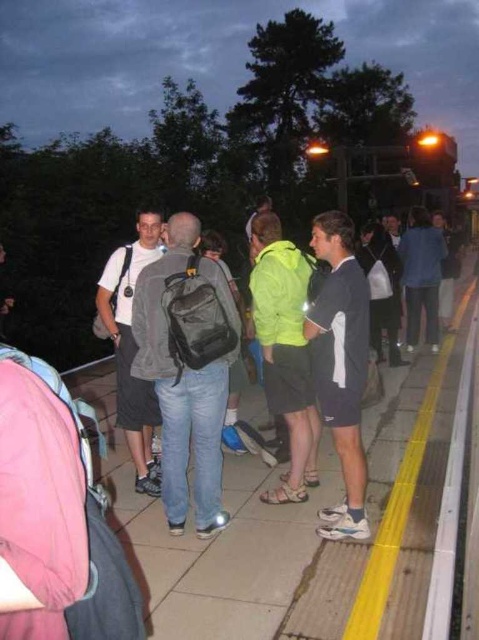
The height and width of the screenshot is (640, 479). What do you see at coordinates (285, 348) in the screenshot? I see `neon green fabric jacket at center` at bounding box center [285, 348].

From the picture: Who is more distant from viewer, (311, 433) or (122, 262)?

Positioned behind is point (122, 262).

Does point (272, 364) come closer to viewer compared to point (130, 392)?

Yes, it is in front of point (130, 392).

The image size is (479, 640). In order to click on neon green fabric jacket at center in this screenshot , I will do `click(285, 348)`.

Who is more distant from viewer, (341, 348) or (122, 312)?

The point (122, 312) is behind.

Between dark blue jersey at center and white matte t-shirt at center, which one is positioned lower?

Positioned lower is dark blue jersey at center.

I want to click on dark blue jersey at center, so click(x=341, y=364).

Can you confirm if matte gray pavement at center is thinner than white matte t-shirt at center?

Incorrect, matte gray pavement at center's width is not less than white matte t-shirt at center's.

Which is behind, point (213, 547) or point (144, 392)?

Positioned behind is point (144, 392).

You are a GUI agent. You are given a task and a screenshot of the screen. Output one action in this format:
    pyautogui.click(x=<x>, y=<y>)
    Task: Click on the matte gray pavement at center
    The image size is (479, 640).
    Given the screenshot: What is the action you would take?
    [x=310, y=531]